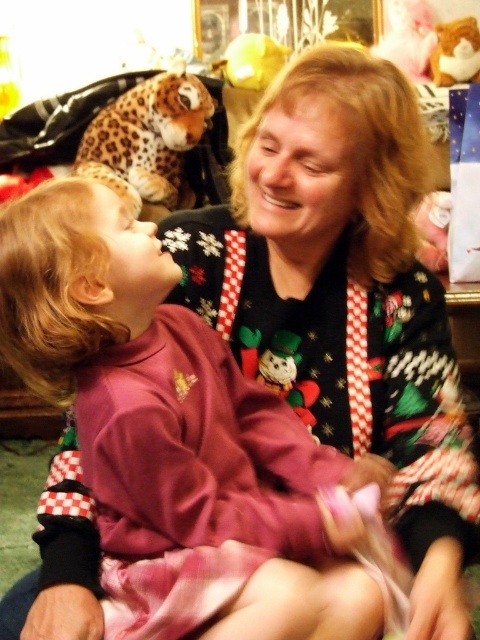
Is purple fleece pajamas at center taller than fluffy plush bear at upper right?

Yes, purple fleece pajamas at center is taller than fluffy plush bear at upper right.

Describe the element at coordinates (175, 419) in the screenshot. I see `purple fleece pajamas at center` at that location.

Is point (25, 241) positioned before point (435, 32)?

Yes, point (25, 241) is in front of point (435, 32).

You are a GUI agent. You are given a task and a screenshot of the screen. Output one action in this format:
    pyautogui.click(x=<x>, y=<y>)
    Task: Click on the purple fleece pajamas at center
    Image resolution: width=480 pixels, height=640 pixels.
    Given the screenshot: What is the action you would take?
    pyautogui.click(x=175, y=419)

Is purple fleece pajamas at center behind plush snowman at center?

That is False.

Which is behind, point (69, 260) or point (263, 381)?

The point (263, 381) is behind.

The width and height of the screenshot is (480, 640). Identify the location of purple fleece pajamas at center. (175, 419).

Where is `purple fleece pajamas at center`? The image size is (480, 640). purple fleece pajamas at center is located at coordinates (175, 419).

Is point (330, 538) behind point (128, 106)?

No.

Who is more forward, (156, 497) or (170, 148)?

Point (156, 497) is more forward.

Locate an element on the screen. This screenshot has width=480, height=640. purple fleece pajamas at center is located at coordinates (175, 419).